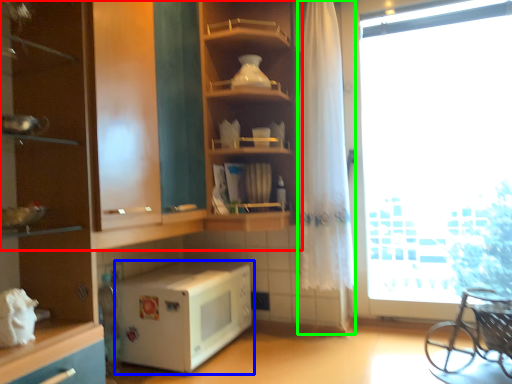
Question: Which object is positioned farthest from shelf (highlighted by a red box)? Select from microwave oven (highlighted by a blue box) and curtain (highlighted by a green box).

Choices:
 (A) microwave oven
 (B) curtain

Answer: (B)